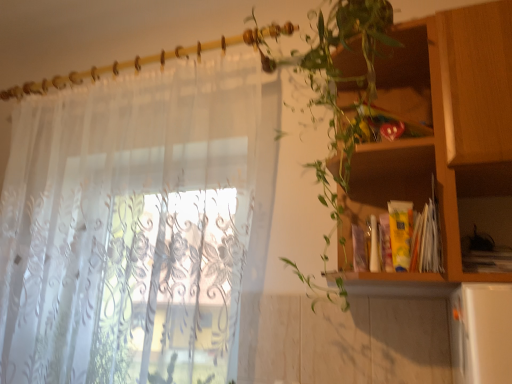
Question: Is wooden cabinet at right taller than translucent white curtain at left?

Choices:
 (A) no
 (B) yes

Answer: (A)

Question: Is wooden cabinet at right aimed at translucent white curtain at left?

Choices:
 (A) no
 (B) yes

Answer: (A)

Question: Considering the relative positions of wooden cabinet at right and translucent white curtain at left in the image provided, is wooden cabinet at right to the right of translucent white curtain at left from the viewer's perspective?

Choices:
 (A) no
 (B) yes

Answer: (B)

Question: Considering the relative sizes of wooden cabinet at right and translucent white curtain at left in the image provided, is wooden cabinet at right thinner than translucent white curtain at left?

Choices:
 (A) yes
 (B) no

Answer: (B)

Question: Is wooden cabinet at right behind translucent white curtain at left?

Choices:
 (A) no
 (B) yes

Answer: (A)

Question: In terms of size, does green leafy plant at upper right appear bigger or smaller than translucent white curtain at left?

Choices:
 (A) small
 (B) big

Answer: (A)

Question: Would you say green leafy plant at upper right is inside or outside translucent white curtain at left?

Choices:
 (A) inside
 (B) outside

Answer: (B)

Question: From the image's perspective, is green leafy plant at upper right positioned above or below translucent white curtain at left?

Choices:
 (A) above
 (B) below

Answer: (A)

Question: Considering the positions of green leafy plant at upper right and translucent white curtain at left in the image, is green leafy plant at upper right taller or shorter than translucent white curtain at left?

Choices:
 (A) short
 (B) tall

Answer: (A)

Question: Considering their positions, is wooden cabinet at right located in front of or behind green leafy plant at upper right?

Choices:
 (A) front
 (B) behind

Answer: (B)

Question: Is point (449, 180) positioned closer to the camera than point (331, 8)?

Choices:
 (A) closer
 (B) farther

Answer: (A)

Question: Is wooden cabinet at right to the left or to the right of green leafy plant at upper right in the image?

Choices:
 (A) left
 (B) right

Answer: (B)

Question: Is wooden cabinet at right bigger or smaller than green leafy plant at upper right?

Choices:
 (A) small
 (B) big

Answer: (A)

Question: Is green leafy plant at upper right inside or outside of wooden cabinet at right?

Choices:
 (A) outside
 (B) inside

Answer: (A)

Question: Is point (342, 137) closer or farther from the camera than point (381, 203)?

Choices:
 (A) farther
 (B) closer

Answer: (B)